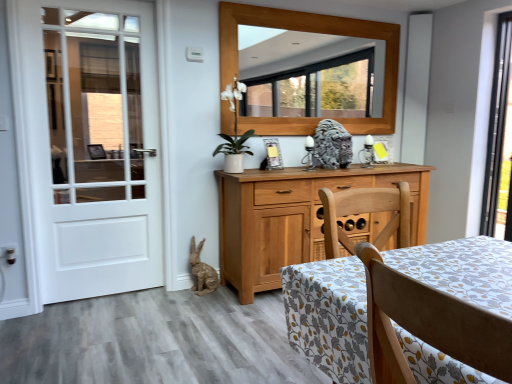
I want to click on light brown wood chair at lower right, so click(428, 324).

What do you see at coordinates (332, 145) in the screenshot? The height and width of the screenshot is (384, 512). I see `gray stone lion at center, positioned as the 2th animal in bottom-to-top order` at bounding box center [332, 145].

Where is `burlap-textured rabbit at lower left, the 2th animal viewed from the top`? burlap-textured rabbit at lower left, the 2th animal viewed from the top is located at coordinates (202, 271).

This screenshot has width=512, height=384. What do you see at coordinates (95, 146) in the screenshot?
I see `white wooden door at left` at bounding box center [95, 146].

In order to face white wooden door at left, should I rotate leftwards or rightwards?

Rotate your view left by about 20.098°.

Image resolution: width=512 pixels, height=384 pixels. In order to click on light brown wood chair at lower right in this screenshot , I will do `click(428, 324)`.

How different are the orientations of white wooden door at left and wooden frame at upper center in degrees?

1.12 degrees.

Is white wooden door at left in contact with wooden frame at upper center?

They are not placed beside each other.

Is wooden frame at upper center inside white wooden door at left?

No, wooden frame at upper center is not inside white wooden door at left.

How much distance is there between white wooden door at left and wooden frame at upper center?

white wooden door at left is 6.45 feet away from wooden frame at upper center.

What's the angular difference between matte wooden picture frame at center and gray stone lion at center, the first animal from the top,'s facing directions?

22.7 degrees separate the facing orientations of matte wooden picture frame at center and gray stone lion at center, the first animal from the top.

The height and width of the screenshot is (384, 512). I want to click on picture frame that appears below the gray stone lion at center, the second animal when ordered from left to right (from the image's perspective), so click(x=273, y=153).

Would you say matte wooden picture frame at center contains gray stone lion at center, positioned as the 2th animal in bottom-to-top order?

No, matte wooden picture frame at center does not contain gray stone lion at center, positioned as the 2th animal in bottom-to-top order.

Can you confirm if matte wooden picture frame at center is taller than gray stone lion at center, the 1th animal positioned from the right?

No, matte wooden picture frame at center is not taller than gray stone lion at center, the 1th animal positioned from the right.

Do you think light brown wood chair at lower right is within gray stone lion at center, the second animal when ordered from left to right, or outside of it?

light brown wood chair at lower right is located beyond the bounds of gray stone lion at center, the second animal when ordered from left to right.

Consider the image. Can you confirm if light brown wood chair at lower right is wider than gray stone lion at center, positioned as the 2th animal in bottom-to-top order?

Yes, light brown wood chair at lower right is wider than gray stone lion at center, positioned as the 2th animal in bottom-to-top order.

From a real-world perspective, is light brown wood chair at lower right below gray stone lion at center, the 1th animal positioned from the right?

Yes, from a real-world perspective, light brown wood chair at lower right is beneath gray stone lion at center, the 1th animal positioned from the right.

Is matte wooden picture frame at center aimed at light brown wood chair at lower right?

No, matte wooden picture frame at center is not oriented towards light brown wood chair at lower right.

Consider the image. Which object is positioned more to the left, matte wooden picture frame at center or light brown wood chair at lower right?

matte wooden picture frame at center is more to the left.

Based on their sizes in the image, would you say matte wooden picture frame at center is bigger or smaller than light brown wood chair at lower right?

Considering their sizes, matte wooden picture frame at center takes up less space than light brown wood chair at lower right.

Which of these two, burlap-textured rabbit at lower left, acting as the 1th animal starting from the bottom, or matte wooden picture frame at center, stands shorter?

Standing shorter between the two is matte wooden picture frame at center.

Is burlap-textured rabbit at lower left, acting as the 1th animal starting from the bottom, wider or thinner than matte wooden picture frame at center?

In the image, burlap-textured rabbit at lower left, acting as the 1th animal starting from the bottom, appears to be wider than matte wooden picture frame at center.

Considering the positions of points (212, 285) and (264, 139), is point (212, 285) farther from camera compared to point (264, 139)?

No.

Is gray stone lion at center, positioned as the 2th animal in bottom-to-top order, at the back of burlap-textured rabbit at lower left, arranged as the first animal when viewed from the left?

No, burlap-textured rabbit at lower left, arranged as the first animal when viewed from the left, is not facing away from gray stone lion at center, positioned as the 2th animal in bottom-to-top order.

Can you confirm if burlap-textured rabbit at lower left, which is counted as the 2th animal, starting from the right, is bigger than gray stone lion at center, the first animal from the top?

No, burlap-textured rabbit at lower left, which is counted as the 2th animal, starting from the right, is not bigger than gray stone lion at center, the first animal from the top.

Is burlap-textured rabbit at lower left, which is counted as the 2th animal, starting from the right, to the right of gray stone lion at center, the first animal from the top, from the viewer's perspective?

Incorrect, burlap-textured rabbit at lower left, which is counted as the 2th animal, starting from the right, is not on the right side of gray stone lion at center, the first animal from the top.

Would you consider burlap-textured rabbit at lower left, acting as the 1th animal starting from the bottom, to be distant from gray stone lion at center, the first animal from the top?

Yes, burlap-textured rabbit at lower left, acting as the 1th animal starting from the bottom, and gray stone lion at center, the first animal from the top, are quite far apart.

Between point (316, 68) and point (205, 288), which one is positioned in front?

Positioned in front is point (205, 288).

Visually, is wooden frame at upper center positioned to the left or to the right of burlap-textured rabbit at lower left, arranged as the first animal when viewed from the left?

In the image, wooden frame at upper center appears on the right side of burlap-textured rabbit at lower left, arranged as the first animal when viewed from the left.

Is burlap-textured rabbit at lower left, the 2th animal viewed from the top, located within wooden frame at upper center?

No, burlap-textured rabbit at lower left, the 2th animal viewed from the top, is located outside of wooden frame at upper center.

Is burlap-textured rabbit at lower left, acting as the 1th animal starting from the bottom, at the back of wooden frame at upper center?

No, wooden frame at upper center is not facing the opposite direction of burlap-textured rabbit at lower left, acting as the 1th animal starting from the bottom.

This screenshot has width=512, height=384. Find the location of `door lying on the left of wooden frame at upper center`. door lying on the left of wooden frame at upper center is located at coordinates (95, 146).

Find the location of a particular element. picture frame below the gray stone lion at center, the 1th animal positioned from the right (from a real-world perspective) is located at coordinates (273, 153).

Considering their positions, is light brown wood chair at lower right positioned closer to burlap-textured rabbit at lower left, acting as the 1th animal starting from the bottom, than gray stone lion at center, positioned as the 2th animal in bottom-to-top order?

gray stone lion at center, positioned as the 2th animal in bottom-to-top order.

Considering their positions, is gray stone lion at center, positioned as the 2th animal in bottom-to-top order, positioned closer to matte wooden picture frame at center than wooden frame at upper center?

Among the two, gray stone lion at center, positioned as the 2th animal in bottom-to-top order, is located nearer to matte wooden picture frame at center.

Based on their spatial positions, is gray stone lion at center, the 1th animal positioned from the right, or wooden frame at upper center further from light brown wood chair at lower right?

Based on the image, wooden frame at upper center appears to be further to light brown wood chair at lower right.

Based on their spatial positions, is white wooden door at left or burlap-textured rabbit at lower left, which is counted as the 2th animal, starting from the right, further from matte wooden picture frame at center?

white wooden door at left is positioned further to the anchor matte wooden picture frame at center.

Which object lies further to the anchor point wooden frame at upper center, light brown wood chair at lower right or gray stone lion at center, positioned as the 2th animal in bottom-to-top order?

light brown wood chair at lower right.

Considering their positions, is gray stone lion at center, the second animal when ordered from left to right, positioned further to matte wooden picture frame at center than light brown wood chair at lower right?

Based on the image, light brown wood chair at lower right appears to be further to matte wooden picture frame at center.

Estimate the real-world distances between objects in this image. Which object is further from wooden frame at upper center, light brown wood chair at lower right or burlap-textured rabbit at lower left, acting as the 1th animal starting from the bottom?

light brown wood chair at lower right is further to wooden frame at upper center.

Estimate the real-world distances between objects in this image. Which object is further from matte wooden picture frame at center, burlap-textured rabbit at lower left, acting as the 1th animal starting from the bottom, or gray stone lion at center, the second animal when ordered from left to right?

The object further to matte wooden picture frame at center is burlap-textured rabbit at lower left, acting as the 1th animal starting from the bottom.

The width and height of the screenshot is (512, 384). Find the location of `mirror located between light brown wood chair at lower right and matte wooden picture frame at center in the depth direction`. mirror located between light brown wood chair at lower right and matte wooden picture frame at center in the depth direction is located at coordinates [x=310, y=74].

At what (x,y) coordinates should I click in order to perform the action: click on picture frame between gray stone lion at center, positioned as the 2th animal in bottom-to-top order, and burlap-textured rabbit at lower left, arranged as the first animal when viewed from the left, in the up-down direction. Please return your answer as a coordinate pair (x, y). Looking at the image, I should click on (273, 153).

Identify the location of animal between wooden frame at upper center and matte wooden picture frame at center in the up-down direction. (332, 145).

Where is `animal between white wooden door at left and gray stone lion at center, the 1th animal positioned from the right, in the horizontal direction`? The height and width of the screenshot is (384, 512). animal between white wooden door at left and gray stone lion at center, the 1th animal positioned from the right, in the horizontal direction is located at coordinates (202, 271).